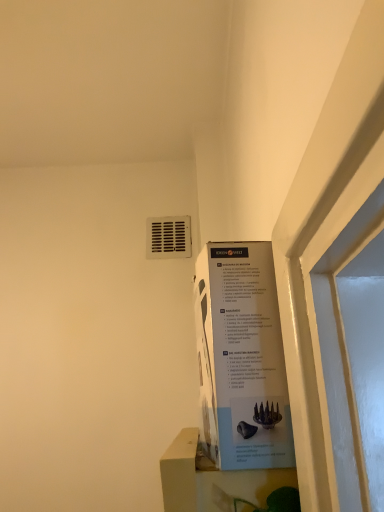
Question: Considering their positions, is white plastic vent at upper center located in front of or behind white matte window sill at lower center?

Choices:
 (A) behind
 (B) front

Answer: (A)

Question: From a real-world perspective, is white plastic vent at upper center physically located above or below white matte window sill at lower center?

Choices:
 (A) above
 (B) below

Answer: (A)

Question: Which object is positioned closest to the white cardboard poster at upper right?

Choices:
 (A) white plastic vent at upper center
 (B) white matte window sill at lower center

Answer: (B)

Question: Estimate the real-world distances between objects in this image. Which object is farther from the white cardboard poster at upper right?

Choices:
 (A) white matte window sill at lower center
 (B) white plastic vent at upper center

Answer: (B)